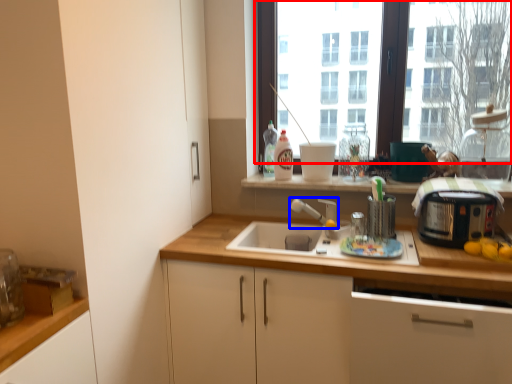
Question: Which of the following is the farthest to the observer, window (highlighted by a red box) or faucet (highlighted by a blue box)?

Choices:
 (A) window
 (B) faucet

Answer: (A)